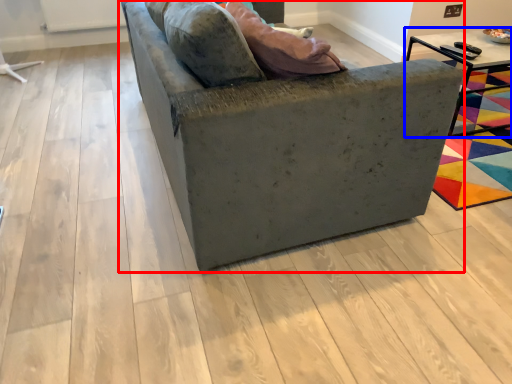
Question: Which object is closer to the camera taking this photo, studio couch (highlighted by a red box) or table (highlighted by a blue box)?

Choices:
 (A) studio couch
 (B) table

Answer: (A)